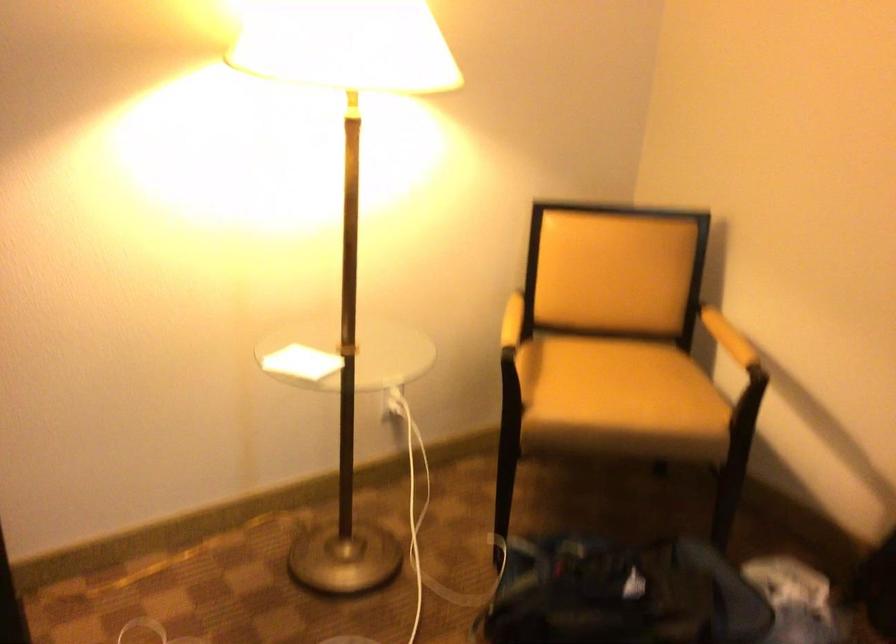
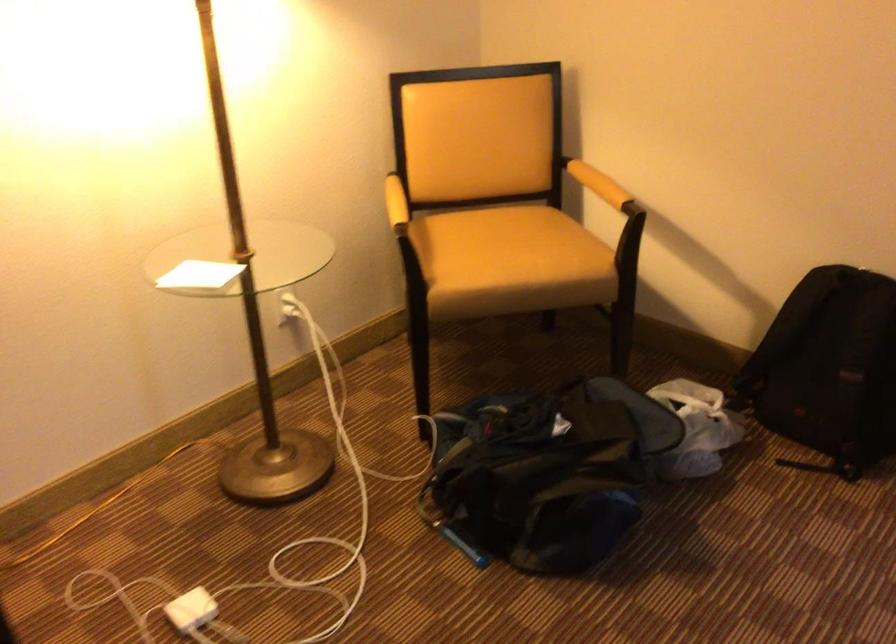
Locate, in the second image, the point that corresponds to point 507,321 in the first image.

(395, 203)